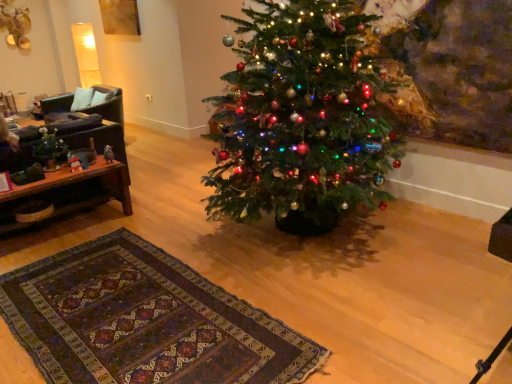
In order to face brown wooden table at left, should I rotate leftwards or rightwards?

You should rotate left by 25.239 degrees.

The width and height of the screenshot is (512, 384). I want to click on black leather armchair at left, so click(108, 105).

Identify the location of brown wooden table at left. The height and width of the screenshot is (384, 512). (80, 181).

Where is `armchair behind the brown wooden table at left`? armchair behind the brown wooden table at left is located at coordinates point(108,105).

Considering the sizes of black leather armchair at left and brown wooden table at left in the image, is black leather armchair at left bigger or smaller than brown wooden table at left?

Clearly, black leather armchair at left is larger in size than brown wooden table at left.

Measure the distance from black leather armchair at left to brown wooden table at left.

black leather armchair at left is 29.35 inches from brown wooden table at left.

Is black leather armchair at left positioned beyond the bounds of brown wooden table at left?

Yes, black leather armchair at left is not within brown wooden table at left.

From the image's perspective, is brown wooden table at left on matte black vase at left?

No, from the image's perspective, brown wooden table at left is not above matte black vase at left.

Is brown wooden table at left not within matte black vase at left?

Yes.

From the picture: Does brown wooden table at left have a lesser height compared to matte black vase at left?

Incorrect, the height of brown wooden table at left does not fall short of that of matte black vase at left.

Considering the sizes of brown wooden table at left and black leather armchair at left in the image, is brown wooden table at left taller or shorter than black leather armchair at left?

Clearly, brown wooden table at left is shorter compared to black leather armchair at left.

Between brown wooden table at left and black leather armchair at left, which one is positioned in front?

brown wooden table at left is in front.

From the image's perspective, does brown wooden table at left appear lower than black leather armchair at left?

Indeed, from the image's perspective, brown wooden table at left is shown beneath black leather armchair at left.

Is the surface of brown wooden table at left in direct contact with black leather armchair at left?

No, brown wooden table at left is not with black leather armchair at left.

Based on the photo, who is taller, black leather armchair at left or matte black vase at left?

Standing taller between the two is black leather armchair at left.

Can you confirm if black leather armchair at left is bigger than matte black vase at left?

Yes, black leather armchair at left is bigger than matte black vase at left.

Image resolution: width=512 pixels, height=384 pixels. I want to click on armchair on the left of matte black vase at left, so click(x=108, y=105).

How many degrees apart are the facing directions of black leather armchair at left and matte black vase at left?

93.9 degrees.

Is matte black vase at left taller or shorter than brown wooden table at left?

matte black vase at left is shorter than brown wooden table at left.

From the picture: Considering the sizes of objects matte black vase at left and brown wooden table at left in the image provided, who is bigger, matte black vase at left or brown wooden table at left?

brown wooden table at left.

From the image's perspective, relative to brown wooden table at left, is matte black vase at left above or below?

Clearly, from the image's perspective, matte black vase at left is above brown wooden table at left.

Is matte black vase at left placed right next to brown wooden table at left?

matte black vase at left and brown wooden table at left are clearly separated.

From a real-world perspective, is matte black vase at left above or below black leather armchair at left?

In terms of real-world spatial position, matte black vase at left is above black leather armchair at left.

Which of these two, matte black vase at left or black leather armchair at left, is smaller?

matte black vase at left.

From the image's perspective, which one is positioned higher, matte black vase at left or black leather armchair at left?

black leather armchair at left.

Is matte black vase at left next to black leather armchair at left?

No.

You are a GUI agent. You are given a task and a screenshot of the screen. Output one action in this format:
    pyautogui.click(x=<x>, y=<y>)
    Task: Click on the table below the black leather armchair at left (from a real-world perspective)
    This screenshot has height=384, width=512.
    Given the screenshot: What is the action you would take?
    pyautogui.click(x=80, y=181)

I want to click on christmas decoration above the brown wooden table at left (from the image's perspective), so click(x=49, y=149).

Considering their positions, is black leather armchair at left positioned closer to brown wooden table at left than matte black vase at left?

matte black vase at left.

Based on their spatial positions, is black leather armchair at left or brown wooden table at left closer to matte black vase at left?

Among the two, brown wooden table at left is located nearer to matte black vase at left.

Considering their positions, is matte black vase at left positioned further to black leather armchair at left than brown wooden table at left?

brown wooden table at left lies further to black leather armchair at left than the other object.

Looking at the image, which one is located closer to brown wooden table at left, matte black vase at left or black leather armchair at left?

matte black vase at left is positioned closer to the anchor brown wooden table at left.

Looking at the image, which one is located further to matte black vase at left, brown wooden table at left or black leather armchair at left?

The object further to matte black vase at left is black leather armchair at left.

Based on their spatial positions, is brown wooden table at left or matte black vase at left closer to black leather armchair at left?

Based on the image, matte black vase at left appears to be nearer to black leather armchair at left.

The height and width of the screenshot is (384, 512). Identify the location of christmas decoration between brown wooden table at left and black leather armchair at left from front to back. (49, 149).